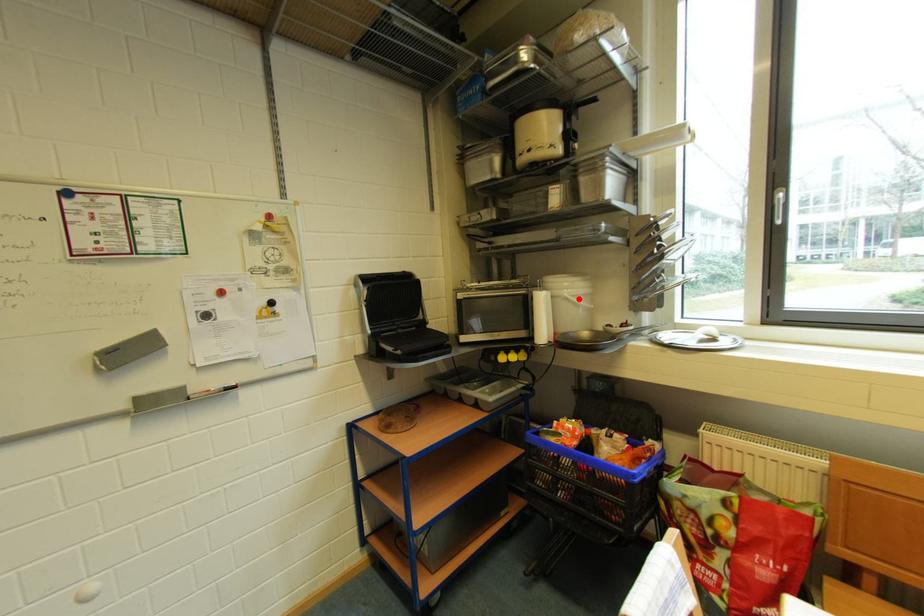
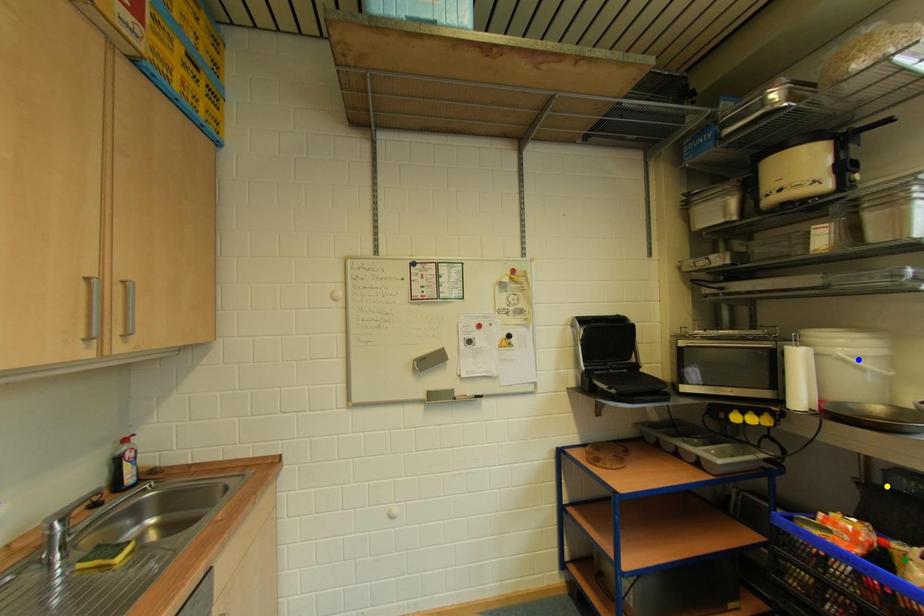
Question: I am providing you with two images of the same scene from different viewpoints. A red point is marked on the first image. You are given multiple points on the second image. Which point in image 2 is actually the same real-world point as the red point in image 1?

Choices:
 (A) blue point
 (B) yellow point
 (C) green point

Answer: (A)